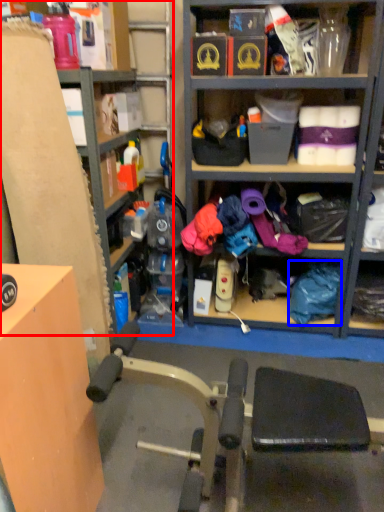
Question: Which point is closer to the camera, shelf (highlighted by a red box) or clothing (highlighted by a blue box)?

Choices:
 (A) shelf
 (B) clothing

Answer: (A)